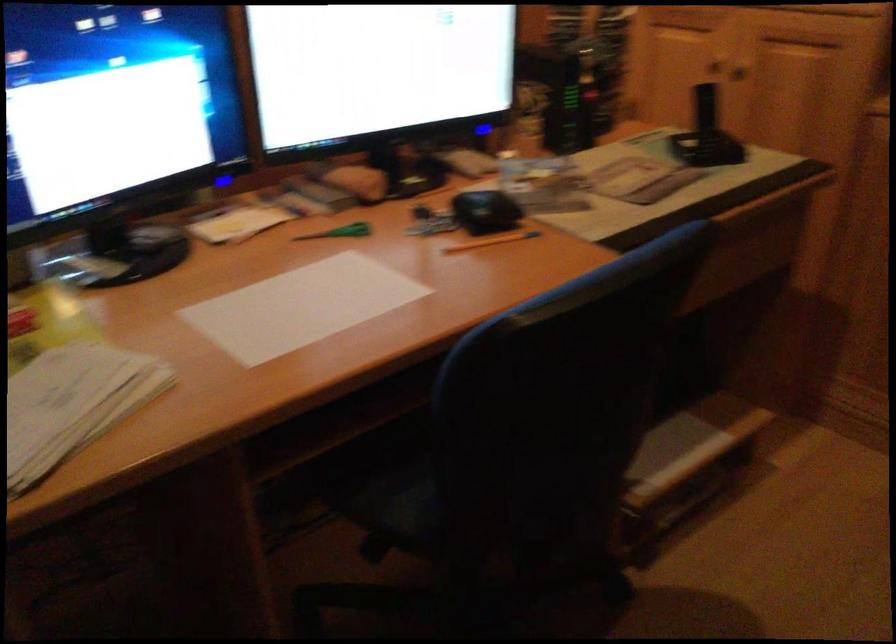
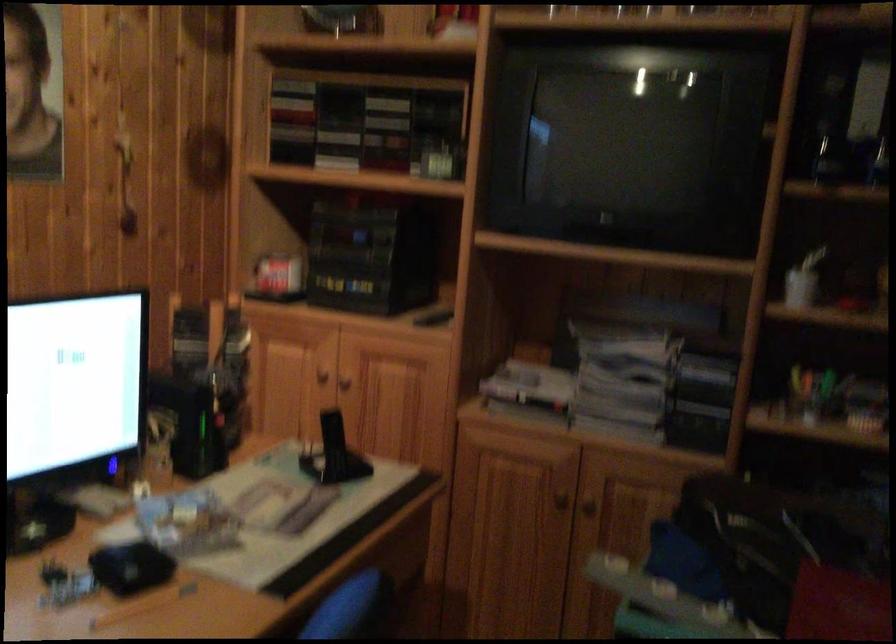
How did the camera likely rotate?

The camera rotated toward right-up.